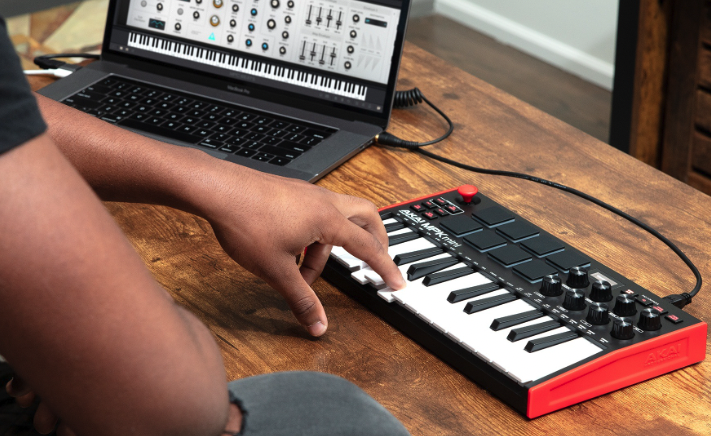
I want to click on knob, so click(549, 290), click(574, 282), click(571, 304), click(594, 314), click(599, 290), click(618, 303), click(652, 317), click(626, 328).